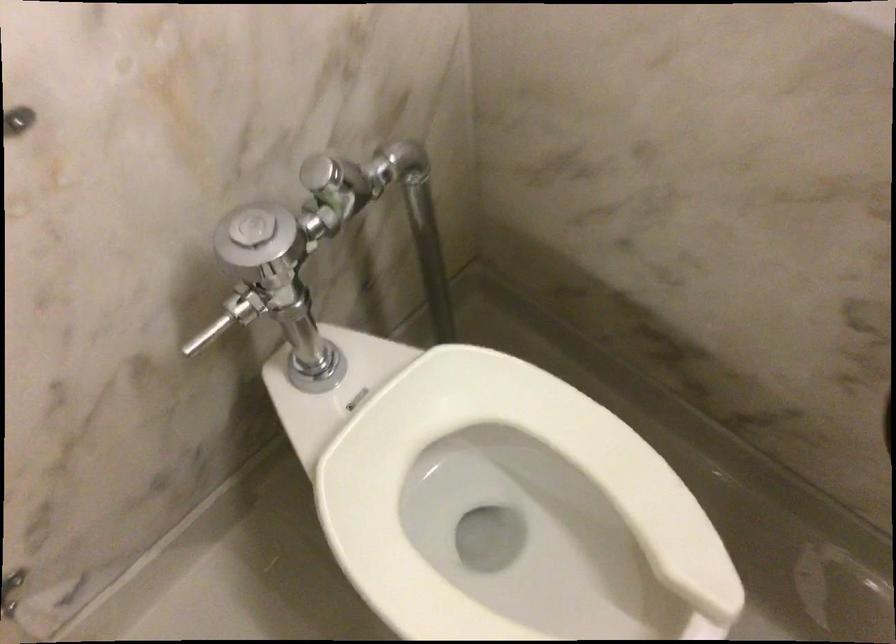
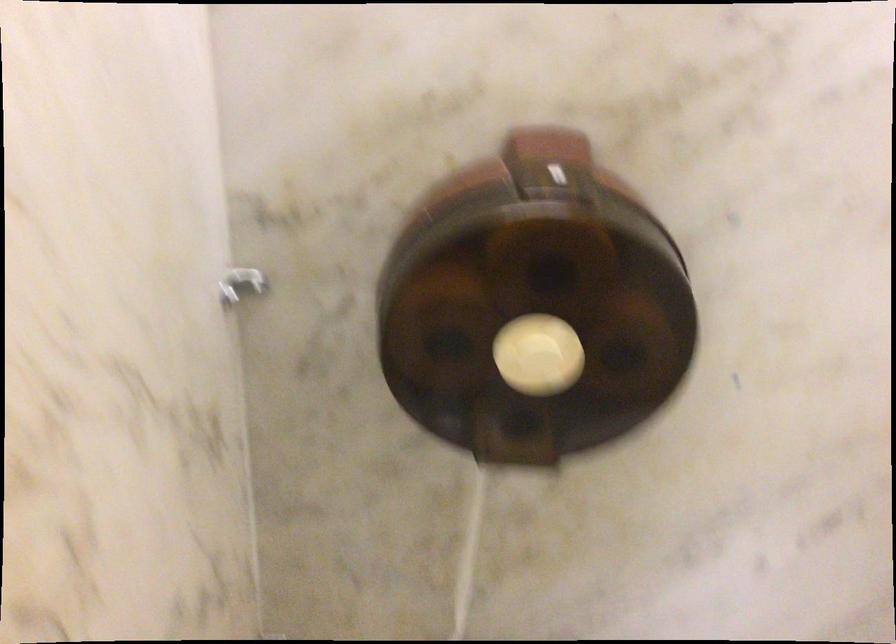
Question: How did the camera likely rotate?

Choices:
 (A) Left
 (B) Right
 (C) Up
 (D) Down

Answer: (B)